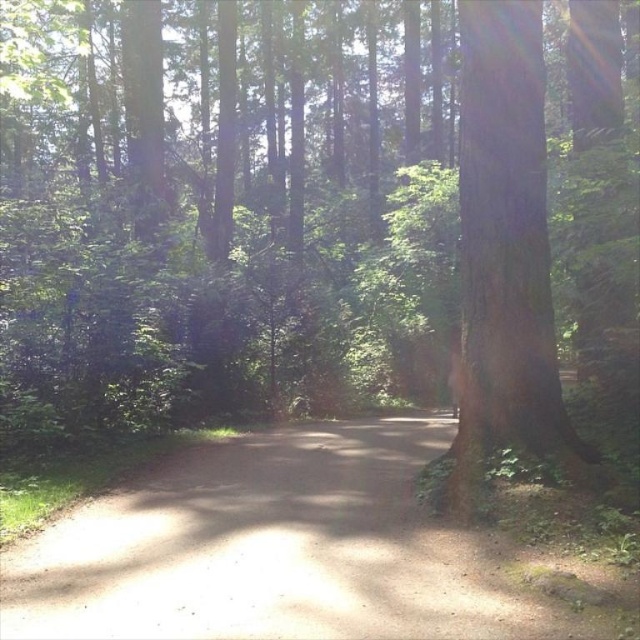
Between point (237, 502) and point (490, 188), which one is positioned in front?

Point (490, 188) is more forward.

How much distance is there between dirt path at center and smooth brown tree trunk at right?

The distance of dirt path at center from smooth brown tree trunk at right is 2.54 meters.

Where is `dirt path at center`? The width and height of the screenshot is (640, 640). dirt path at center is located at coordinates click(280, 550).

Where is `dirt path at center`? The width and height of the screenshot is (640, 640). dirt path at center is located at coordinates (280, 550).